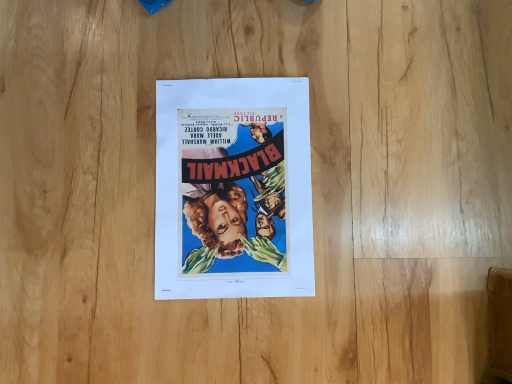
Question: Should I look upward or downward to see matte paper poster at center?

Choices:
 (A) down
 (B) up

Answer: (B)